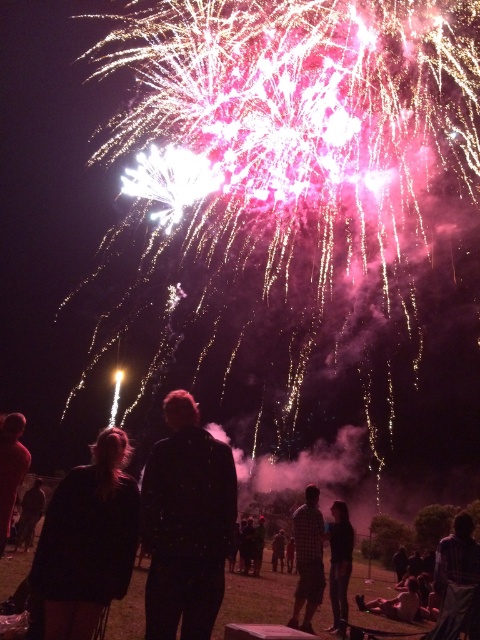
Question: Which object appears closest to the camera in this image?

Choices:
 (A) dark gray pants at lower right
 (B) black matte coat at lower left
 (C) dark plaid shirt at lower right

Answer: (B)

Question: Which is nearer to the dark brown hair at lower left?

Choices:
 (A) black matte jacket at center
 (B) checkered fabric shirt at center
 (C) dark plaid shirt at lower right
 (D) black matte coat at lower left

Answer: (D)

Question: Among these points, which one is nearest to the camera?

Choices:
 (A) (86, 612)
 (B) (35, 516)
 (C) (4, 540)

Answer: (A)

Question: Does black matte jacket at center appear on the left side of dark plaid shirt at lower right?

Choices:
 (A) yes
 (B) no

Answer: (A)

Question: Is dark plaid shirt at lower right smaller than dark brown hair at lower left?

Choices:
 (A) yes
 (B) no

Answer: (B)

Question: Where is black matte jacket at center located in relation to dark plaid shirt at lower right in the image?

Choices:
 (A) right
 (B) left

Answer: (B)